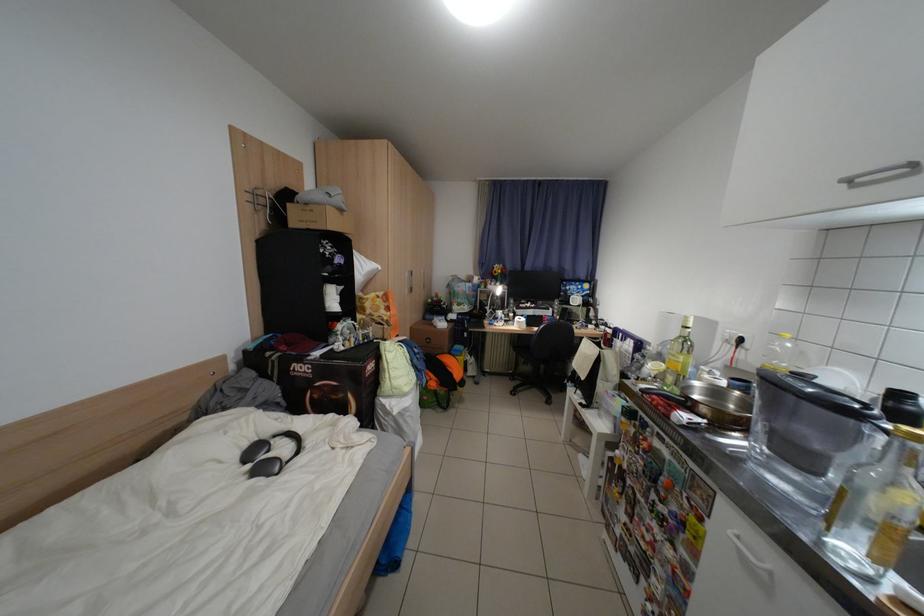
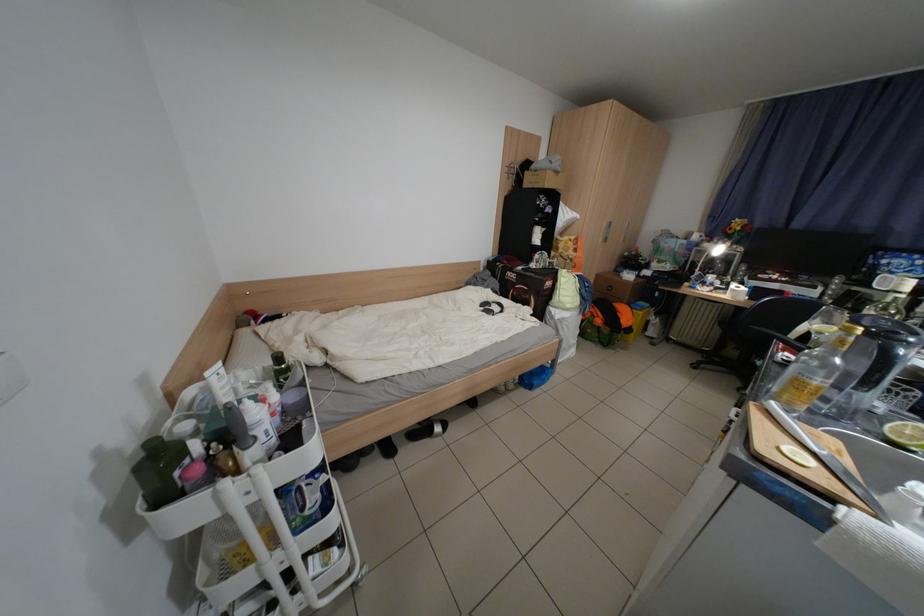
Locate, in the second image, the point that corresponds to (691,413) in the first image.

(799, 355)